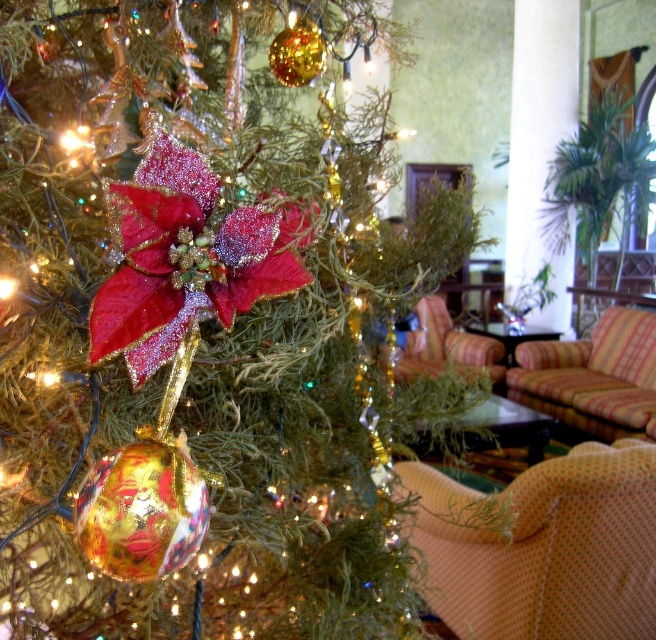
Is orange dotted fabric armchair at lower right to the left of shiny velvet poinsettia at center from the viewer's perspective?

In fact, orange dotted fabric armchair at lower right is to the right of shiny velvet poinsettia at center.

Consider the image. Can you confirm if orange dotted fabric armchair at lower right is shorter than shiny velvet poinsettia at center?

No.

You are a GUI agent. You are given a task and a screenshot of the screen. Output one action in this format:
    pyautogui.click(x=<x>, y=<y>)
    Task: Click on the orange dotted fabric armchair at lower right
    The height and width of the screenshot is (640, 656).
    Given the screenshot: What is the action you would take?
    click(x=543, y=547)

Which is above, striped fabric armchair at right or plaid fabric armchair at right?

plaid fabric armchair at right

What are the coordinates of `striped fabric armchair at right` in the screenshot? It's located at (592, 376).

Where is `striped fabric armchair at right`? This screenshot has width=656, height=640. striped fabric armchair at right is located at coordinates (592, 376).

In order to click on striped fabric armchair at right in this screenshot , I will do `click(592, 376)`.

Between orange dotted fabric armchair at lower right and plaid fabric armchair at right, which one appears on the right side from the viewer's perspective?

Positioned to the right is plaid fabric armchair at right.

Can you confirm if orange dotted fabric armchair at lower right is positioned to the left of plaid fabric armchair at right?

Indeed, orange dotted fabric armchair at lower right is positioned on the left side of plaid fabric armchair at right.

Is point (462, 552) behind point (492, 358)?

No, (462, 552) is closer to viewer.

Identify the location of orange dotted fabric armchair at lower right. (543, 547).